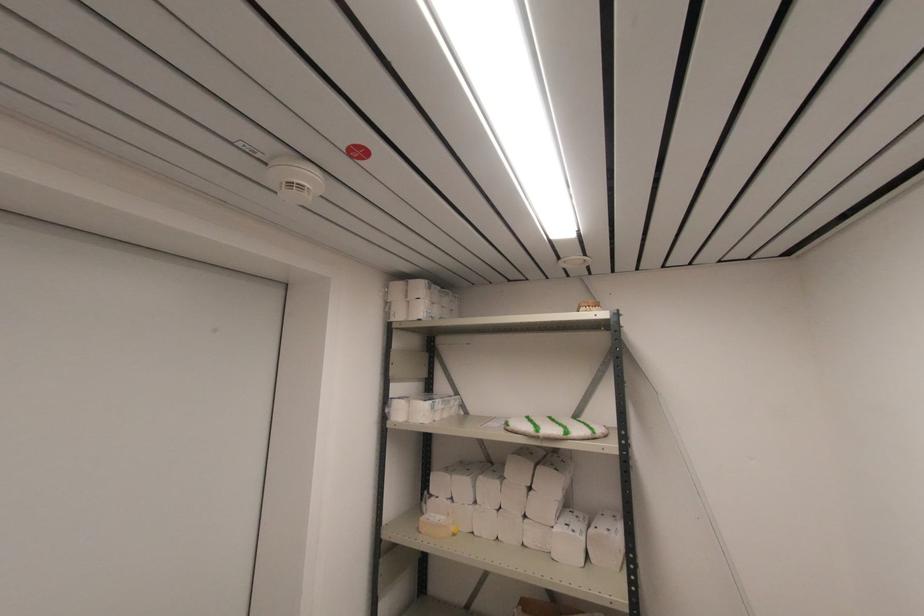
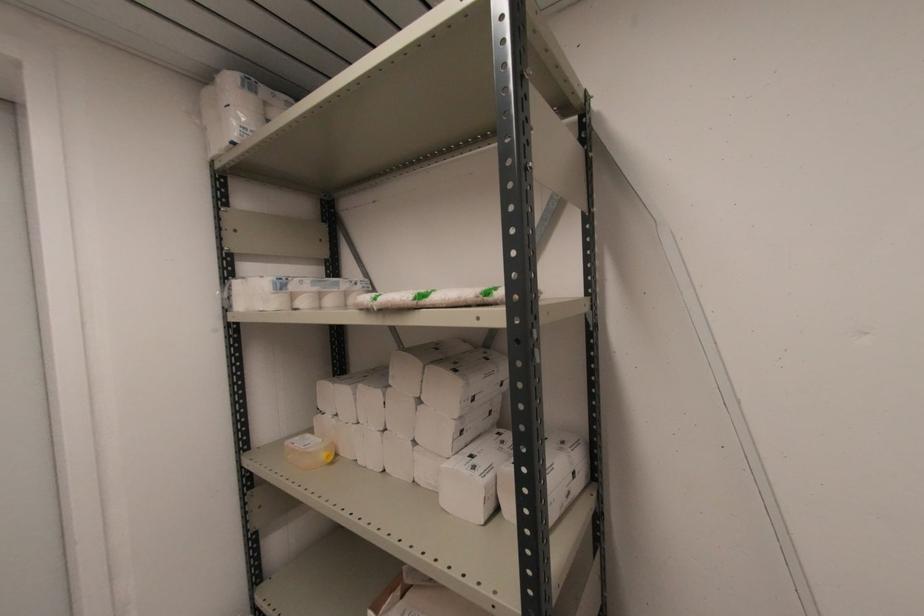
In the second image, find the point that corresponds to [421,519] in the first image.

(289, 442)